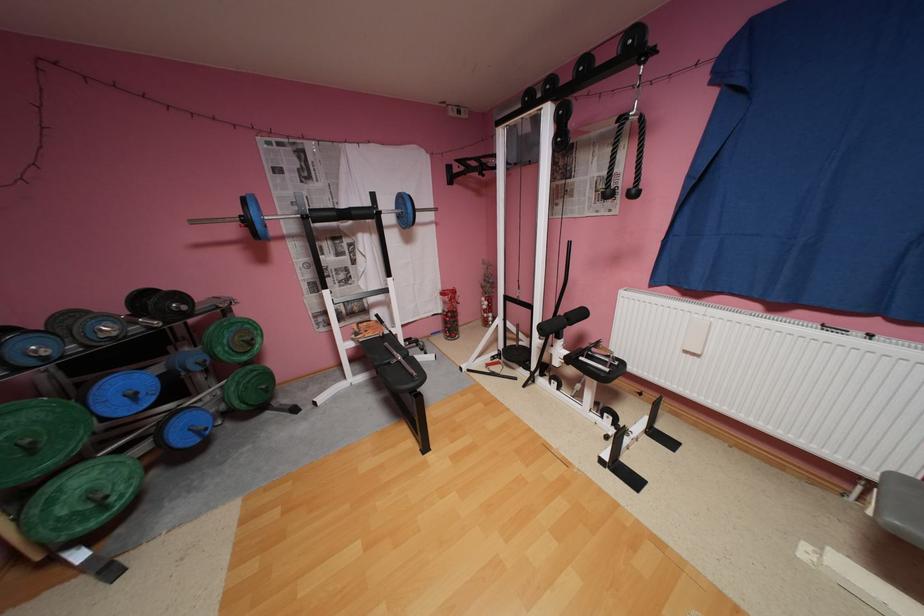
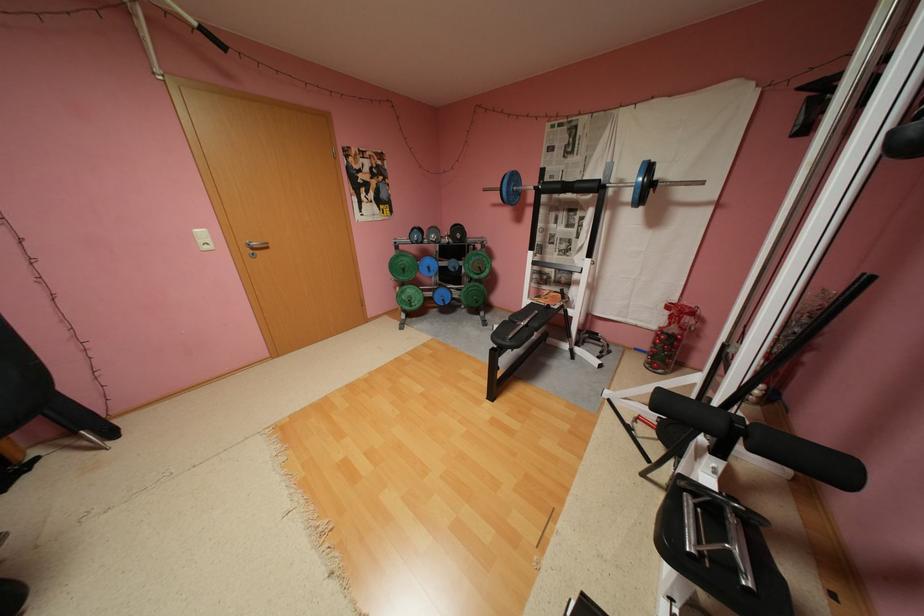
The point at [116,508] is marked in the first image. Where is the corresponding point in the second image?

(419, 306)